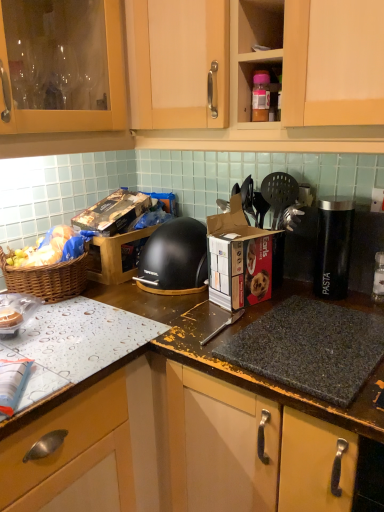
What are the coordinates of `empty space that is ontop of granite at center (from a real-world perspective)` in the screenshot? It's located at (306, 322).